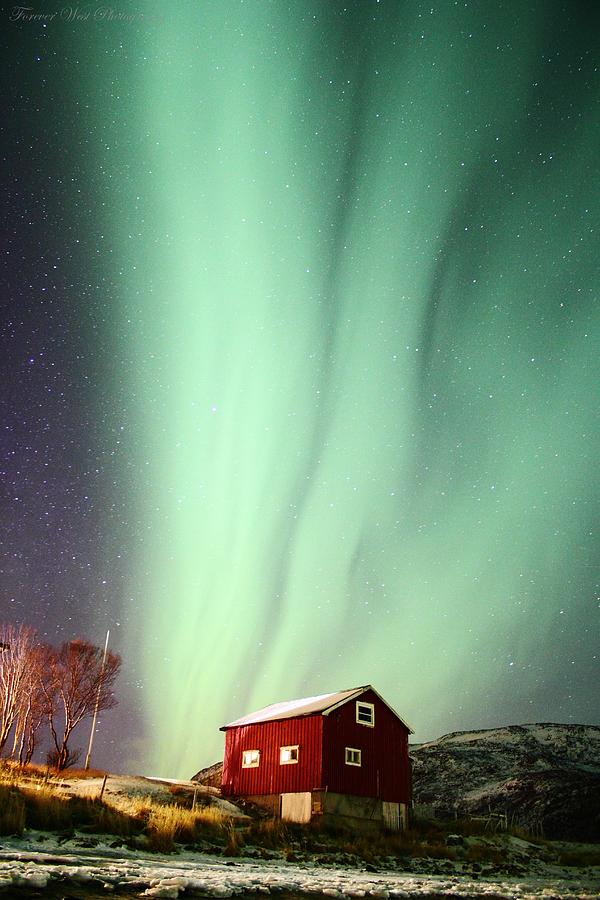
Find the location of a particular element. The width and height of the screenshot is (600, 900). windows is located at coordinates (285, 756), (247, 761), (353, 750), (361, 716).